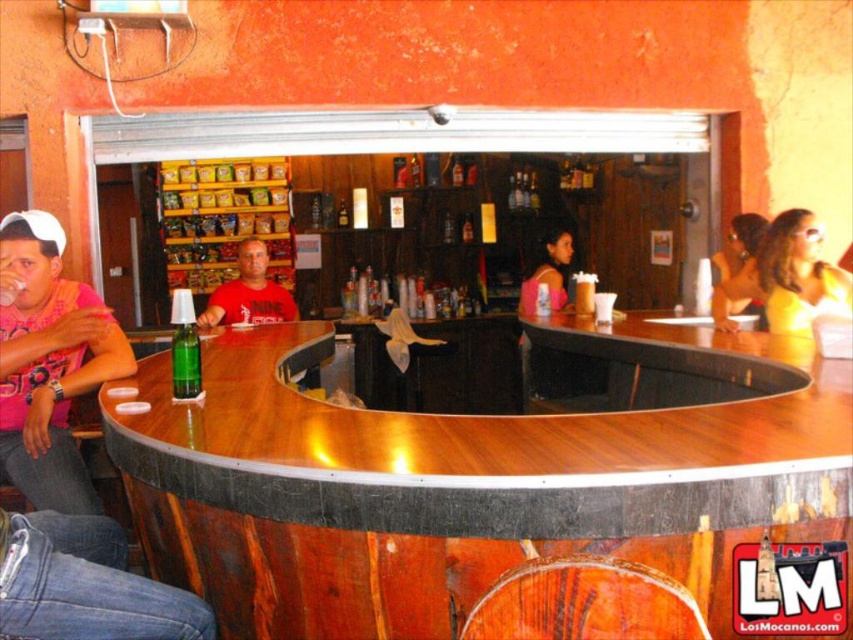
You are a bartender who needs to decide which customer to serve first. The pink matte shirt at left and the yellow fabric dress at center are both waiting for their drinks. Based on their positions and the description, which customer is closer to the edge of the bar counter?

The pink matte shirt at left is closer to the edge of the bar counter because it is thinner than the yellow fabric dress at center, indicating proximity to the edge.

You are a bartender preparing to place a new drink order on the bar. You need to make sure there is enough space between the pink matte shirt at left and the yellow fabric dress at center. Which one is lower so you can place the drink there?

The pink matte shirt at left is positioned under the yellow fabric dress at center, so you can place the drink on the area below the yellow fabric dress at center where the pink matte shirt at left is located.

You are a bartender at the bar and need to place a new drink order between the yellow fabric dress at center and the pink fabric top at center. Which object should you place it next to if you want the drink to be more visible to customers passing by?

The yellow fabric dress at center is larger in size than the pink fabric top at center, so placing the drink next to the yellow fabric dress at center would make it more visible to customers passing by due to its larger size.